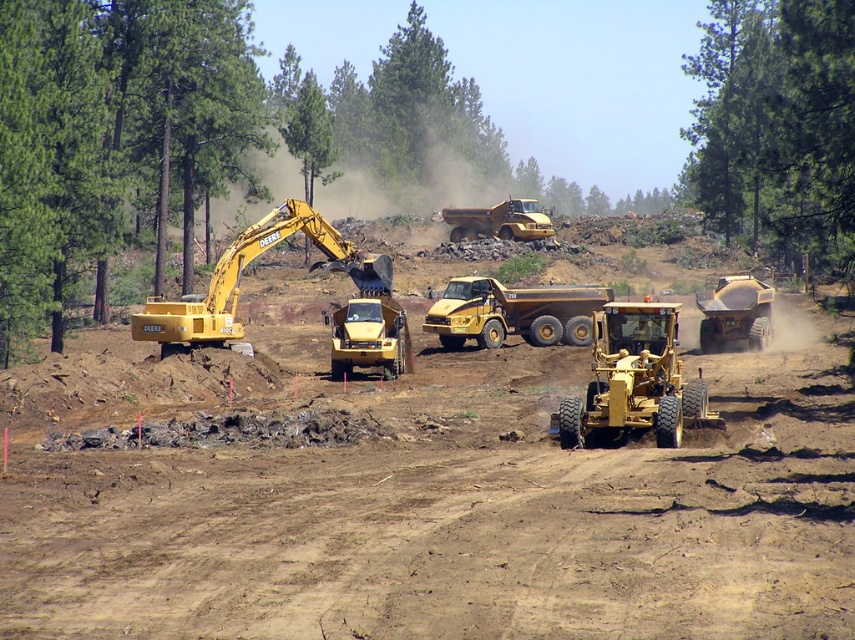
You are a worker standing on the construction site and want to take a photo of the matte yellow tractor at right without including the green leafy tree at upper center in the frame. Is it possible to do so by moving closer to the tractor?

The green leafy tree at upper center is taller than the matte yellow tractor at right. Moving closer to the tractor would reduce the tree in the background, but since the tree is taller, it might still be visible unless you move far enough forward to block it with the tractor itself.

You are a construction worker who needs to access the matte yellow tractor at right. The dump truck is blocking your path. Can you walk around the yellow matte dump truck at center to reach the tractor?

The matte yellow tractor at right is behind the yellow matte dump truck at center, so you can walk around the dump truck to reach the tractor.